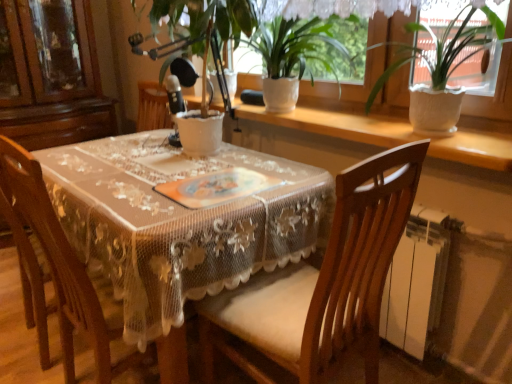
Question: Which direction should I rotate to look at white ceramic pot at center, which is the third houseplant in right-to-left order, — up or down?

Choices:
 (A) up
 (B) down

Answer: (A)

Question: Can you confirm if white ceramic pot at center, the first houseplant from the left, is wider than wooden chair at center, which is the first chair in right-to-left order?

Choices:
 (A) yes
 (B) no

Answer: (B)

Question: Can you see white ceramic pot at center, the first houseplant from the left, touching wooden chair at center, the second chair viewed from the left?

Choices:
 (A) no
 (B) yes

Answer: (A)

Question: Is white ceramic pot at center, which is the third houseplant in right-to-left order, at the left side of wooden chair at center, which is the first chair in right-to-left order?

Choices:
 (A) yes
 (B) no

Answer: (A)

Question: From a real-world perspective, is white ceramic pot at center, which is the third houseplant in right-to-left order, below wooden chair at center, the second chair viewed from the left?

Choices:
 (A) no
 (B) yes

Answer: (A)

Question: From the image's perspective, is white ceramic pot at center, which is the third houseplant in right-to-left order, below wooden chair at center, the second chair viewed from the left?

Choices:
 (A) no
 (B) yes

Answer: (A)

Question: Considering the relative sizes of white ceramic pot at center, the first houseplant from the left, and wooden chair at center, the second chair viewed from the left, in the image provided, is white ceramic pot at center, the first houseplant from the left, bigger than wooden chair at center, the second chair viewed from the left,?

Choices:
 (A) no
 (B) yes

Answer: (A)

Question: From the image's perspective, does white ceramic pot at upper center, arranged as the 2th houseplant when viewed from the right, appear higher than white lace tablecloth at center?

Choices:
 (A) yes
 (B) no

Answer: (A)

Question: Is white ceramic pot at upper center, placed as the 2th houseplant when sorted from left to right, completely or partially outside of white lace tablecloth at center?

Choices:
 (A) yes
 (B) no

Answer: (A)

Question: From the image's perspective, is white ceramic pot at upper center, arranged as the 2th houseplant when viewed from the right, located beneath white lace tablecloth at center?

Choices:
 (A) yes
 (B) no

Answer: (B)

Question: Are white ceramic pot at upper center, arranged as the 2th houseplant when viewed from the right, and white lace tablecloth at center making contact?

Choices:
 (A) no
 (B) yes

Answer: (A)

Question: Is white ceramic pot at upper center, placed as the 2th houseplant when sorted from left to right, not close to white lace tablecloth at center?

Choices:
 (A) no
 (B) yes

Answer: (A)

Question: Is white ceramic pot at upper center, arranged as the 2th houseplant when viewed from the right, to the left of white lace tablecloth at center from the viewer's perspective?

Choices:
 (A) no
 (B) yes

Answer: (A)

Question: Is wooden chair at center, which is the second chair from right to left, to the right of white ceramic pot at upper right, which ranks as the third houseplant in left-to-right order, from the viewer's perspective?

Choices:
 (A) no
 (B) yes

Answer: (A)